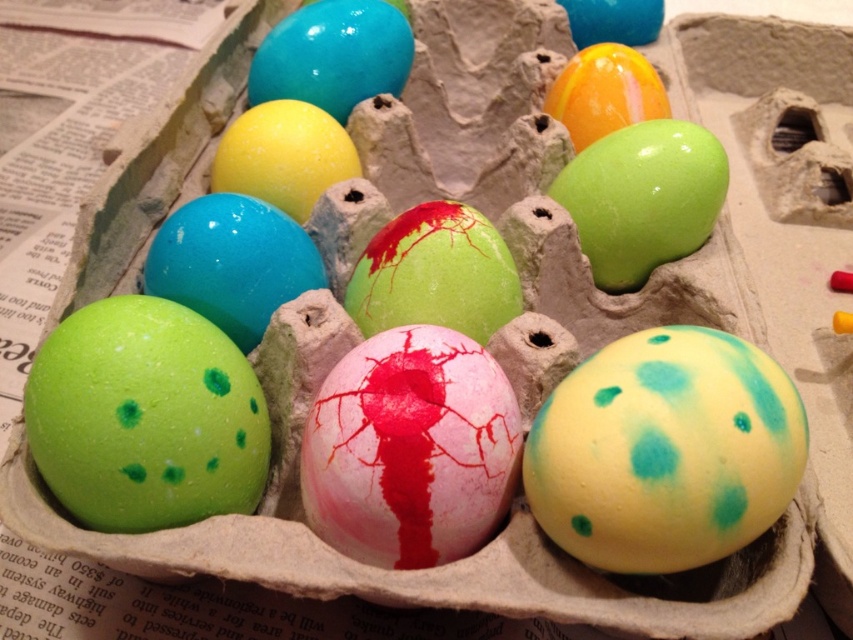
Is matte pink egg at center smaller than glossy green egg at center?

Yes.

Is matte pink egg at center shorter than glossy green egg at center?

Incorrect, matte pink egg at center's height does not fall short of glossy green egg at center's.

Is point (445, 486) less distant than point (612, 182)?

Yes, it is in front of point (612, 182).

Locate an element on the screen. Image resolution: width=853 pixels, height=640 pixels. matte pink egg at center is located at coordinates (410, 449).

Does green matte egg at center have a smaller size compared to matte yellow egg at upper right?

Correct, green matte egg at center occupies less space than matte yellow egg at upper right.

Between point (437, 253) and point (589, 45), which one is positioned in front?

Positioned in front is point (437, 253).

At what (x,y) coordinates should I click in order to perform the action: click on green matte egg at center. Please return your answer as a coordinate pair (x, y). Looking at the image, I should click on (434, 273).

At what (x,y) coordinates should I click in order to perform the action: click on matte blue egg at center. Please return your answer as a coordinate pair (x, y). This screenshot has width=853, height=640. Looking at the image, I should click on (231, 262).

Image resolution: width=853 pixels, height=640 pixels. What do you see at coordinates (231, 262) in the screenshot?
I see `matte blue egg at center` at bounding box center [231, 262].

The width and height of the screenshot is (853, 640). Find the location of `matte blue egg at center`. matte blue egg at center is located at coordinates (231, 262).